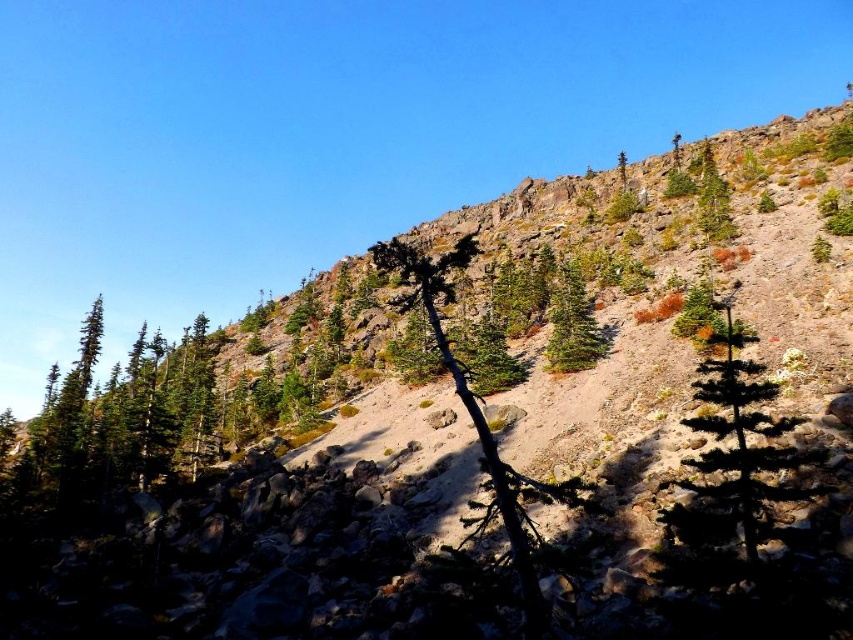
You are a hiker standing at the point with coordinates point (624, 184). You want to reach the summit located at point (741, 492). Which direction should you move to get closer to the summit?

You should move forward because point (741, 492) is in front of point (624, 184).